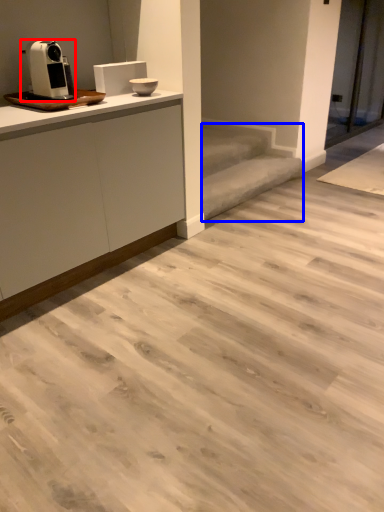
Question: Which object is closer to the camera taking this photo, home appliance (highlighted by a red box) or stair (highlighted by a blue box)?

Choices:
 (A) home appliance
 (B) stair

Answer: (A)